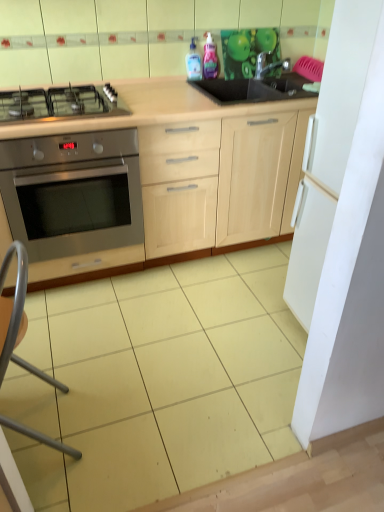
The image size is (384, 512). I want to click on vacant point to the right of transparent plastic bottle at upper center, the 1th bottle positioned from the left, so click(227, 77).